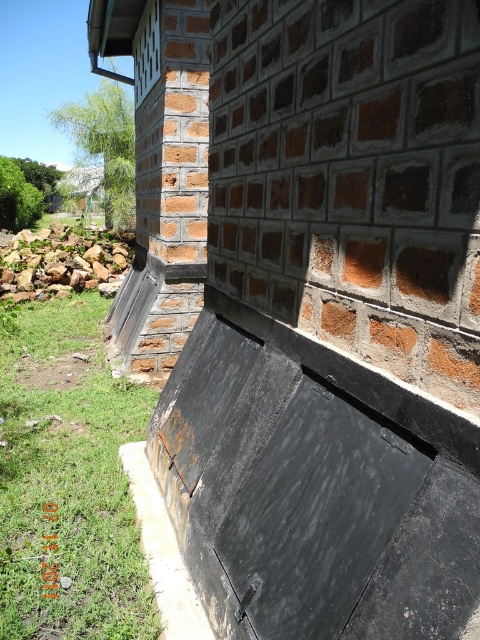
Can you confirm if green grass at lower left is thinner than brown rough stone at lower left?

Correct, green grass at lower left's width is less than brown rough stone at lower left's.

Image resolution: width=480 pixels, height=640 pixels. Identify the location of green grass at lower left. (68, 477).

Where is `green grass at lower left`? The image size is (480, 640). green grass at lower left is located at coordinates (68, 477).